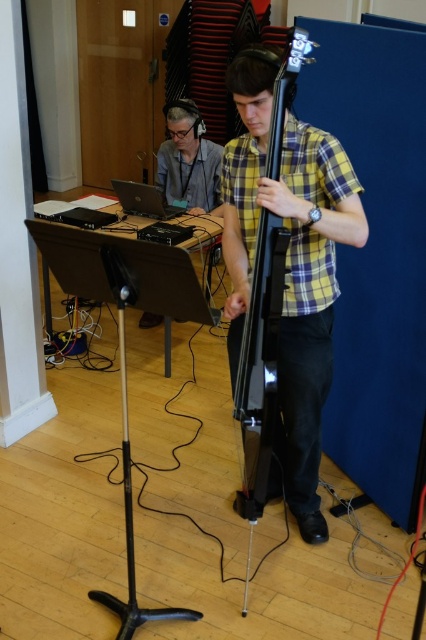
Question: In this image, where is glossy black bass guitar at center located relative to black matte tripod at lower left?

Choices:
 (A) above
 (B) below

Answer: (A)

Question: Estimate the real-world distances between objects in this image. Which object is farther from the silver metallic laptop at center?

Choices:
 (A) matte gray headphones at upper left
 (B) black matte tripod at lower left
 (C) glossy black bass guitar at center

Answer: (B)

Question: Does glossy black bass guitar at center have a lesser width compared to matte gray headphones at upper left?

Choices:
 (A) yes
 (B) no

Answer: (A)

Question: Which of these objects is positioned closest to the black matte tripod at lower left?

Choices:
 (A) glossy black bass guitar at center
 (B) matte gray headphones at upper left
 (C) silver metallic laptop at center

Answer: (A)

Question: Among these points, which one is nearest to the camera?

Choices:
 (A) (203, 150)
 (B) (166, 209)
 (C) (256, 252)

Answer: (C)

Question: Can you confirm if matte gray headphones at upper left is thinner than black matte tripod at lower left?

Choices:
 (A) yes
 (B) no

Answer: (B)